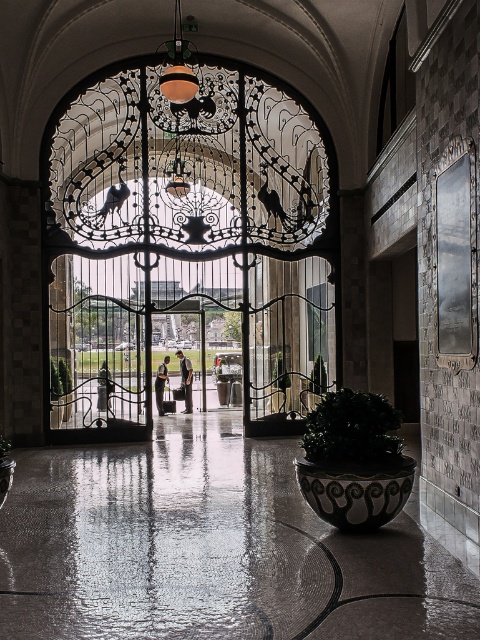
Question: Is dark green leafy plant at lower center positioned in front of green leafy plant at center?

Choices:
 (A) yes
 (B) no

Answer: (A)

Question: Which of the following is the farthest from the observer?

Choices:
 (A) (60, 387)
 (B) (381, 403)

Answer: (A)

Question: Which point is farther to the camera?

Choices:
 (A) green leafy plant at center
 (B) shiny concrete floor at center
 (C) polished metal gate at center
 (D) dark green leafy plant at lower center

Answer: (A)

Question: Does polished metal gate at center appear over dark green leafy plant at lower center?

Choices:
 (A) no
 (B) yes

Answer: (B)

Question: In this image, where is dark green leafy plant at lower center located relative to green leafy plant at center?

Choices:
 (A) above
 (B) below

Answer: (B)

Question: Among these points, which one is farthest from the camera?

Choices:
 (A) (223, 243)
 (B) (288, 580)
 (C) (60, 374)

Answer: (C)